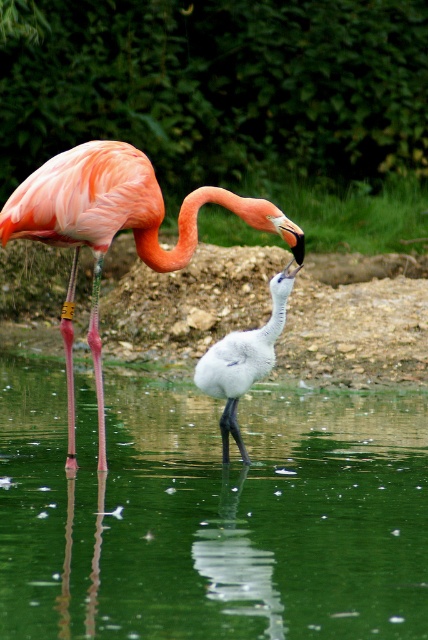
Question: Which is nearer to the matte pink flamingo at upper left?

Choices:
 (A) white feathered bird at center
 (B) green reflective water at center

Answer: (A)

Question: Is green reflective water at center further to the viewer compared to matte pink flamingo at upper left?

Choices:
 (A) no
 (B) yes

Answer: (A)

Question: Is matte pink flamingo at upper left closer to camera compared to white feathered bird at center?

Choices:
 (A) yes
 (B) no

Answer: (A)

Question: Which object appears closest to the camera in this image?

Choices:
 (A) matte pink flamingo at upper left
 (B) green reflective water at center

Answer: (B)

Question: Does green reflective water at center have a greater width compared to white feathered bird at center?

Choices:
 (A) no
 (B) yes

Answer: (B)

Question: Which point is farther to the camera?

Choices:
 (A) (152, 458)
 (B) (145, 170)
 (C) (202, 392)

Answer: (C)